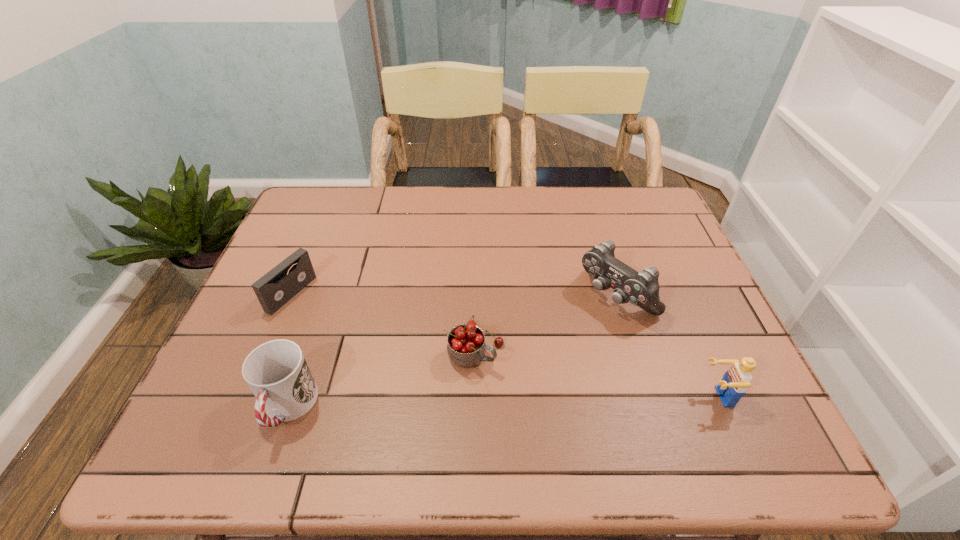
Select which object appears as the third closest to the control. Please provide its 2D coordinates. Your answer should be formatted as a tuple, i.e. [(x, y)], where the tuple contains the x and y coordinates of a point satisfying the conditions above.

[(277, 373)]